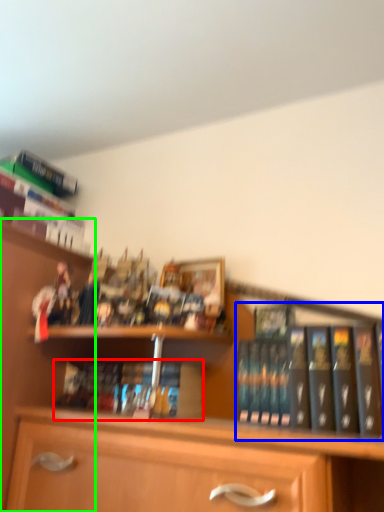
Question: Based on their relative distances, which object is nearer to book (highlighted by a red box)? Choose from book (highlighted by a blue box) and shelf (highlighted by a green box).

Choices:
 (A) book
 (B) shelf

Answer: (B)